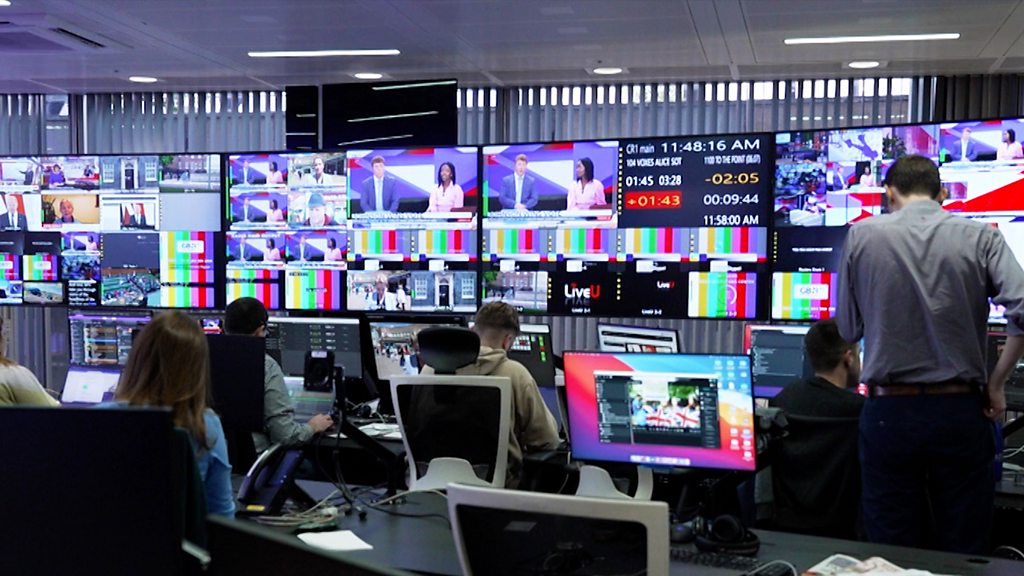
The width and height of the screenshot is (1024, 576). Find the location of `ceiling light`. ceiling light is located at coordinates (139, 83), (348, 54), (364, 74), (614, 69), (861, 37), (863, 64).